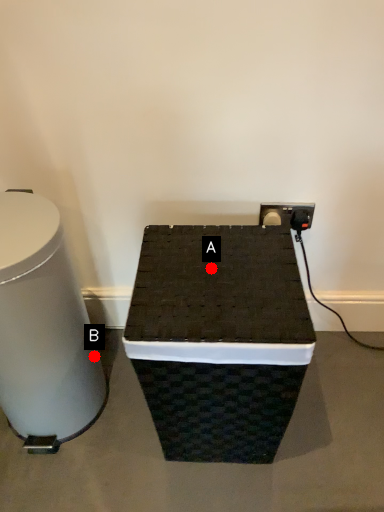
Question: Two points are circled on the image, labeled by A and B beside each circle. Which of the following is the closest to the observer?

Choices:
 (A) A is closer
 (B) B is closer

Answer: (A)